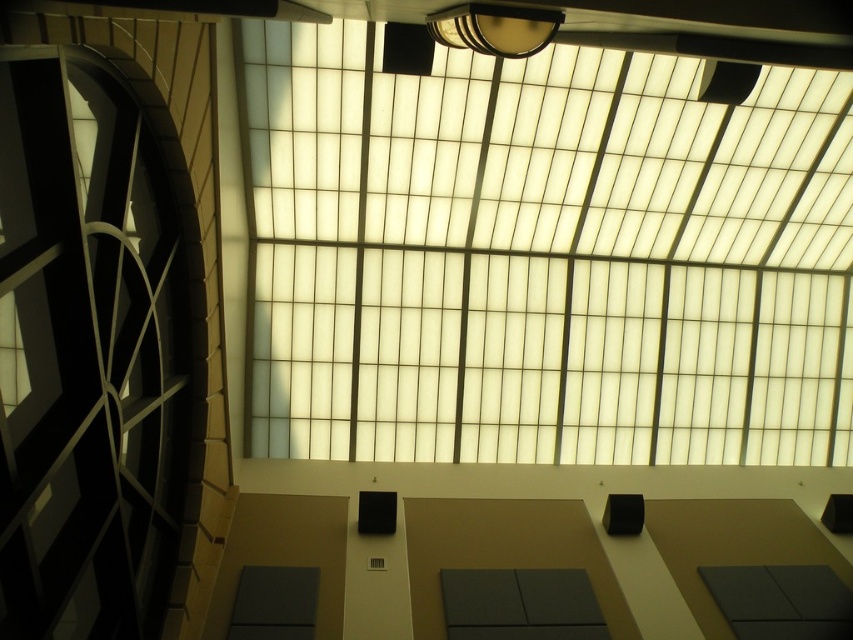
You are an interior designer planning to install a new fixture in the space. You have a choice between placing a new fixture either to the left or the right of the existing fixtures. Considering the white frosted glass at upper center and the metallic gold lamp at upper center, which side would you choose to maintain symmetry if the new fixture must be placed at the same height as these objects?

You should place the new fixture to the right of the metallic gold lamp at upper center because the white frosted glass at upper center is wider than the metallic gold lamp at upper center, creating an imbalance that can be corrected by adding a fixture on the narrower side.

You are an interior designer planning to install a new lighting fixture in the space. You have two options available to you. The first is the matte black clock at left, and the second is the metallic gold lamp at upper center. Which of these two objects is bigger in size?

The matte black clock at left is larger in size than the metallic gold lamp at upper center.

You are an interior designer assessing the space. You need to ensure that the matte black clock at left and the metallic gold lamp at upper center are proportionally balanced. Given their widths, which object should be placed in a more prominent position to maintain visual harmony?

The matte black clock at left has a greater width than the metallic gold lamp at upper center. To maintain visual harmony, the wider matte black clock at left should be placed in a more prominent position, while the narrower metallic gold lamp at upper center can be positioned in a less dominant area.